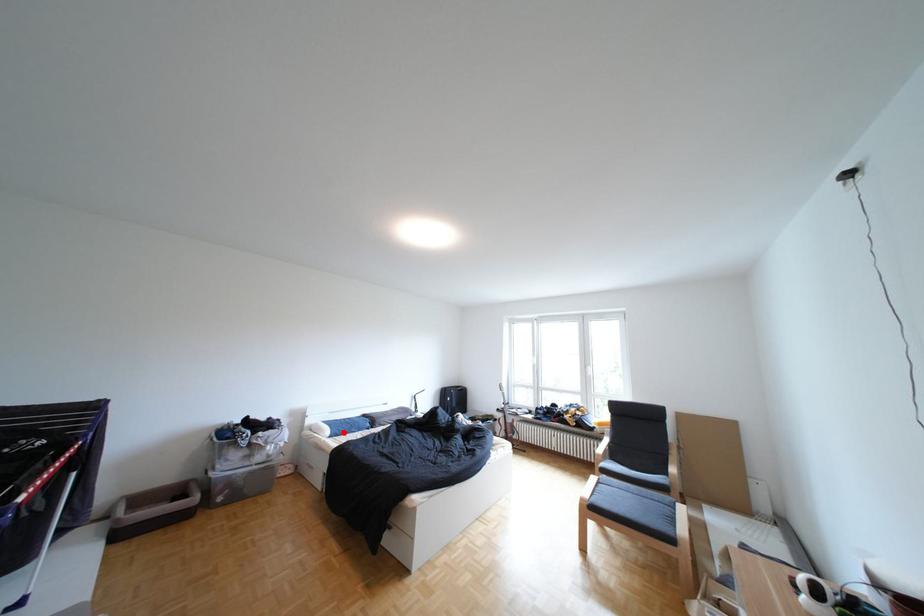
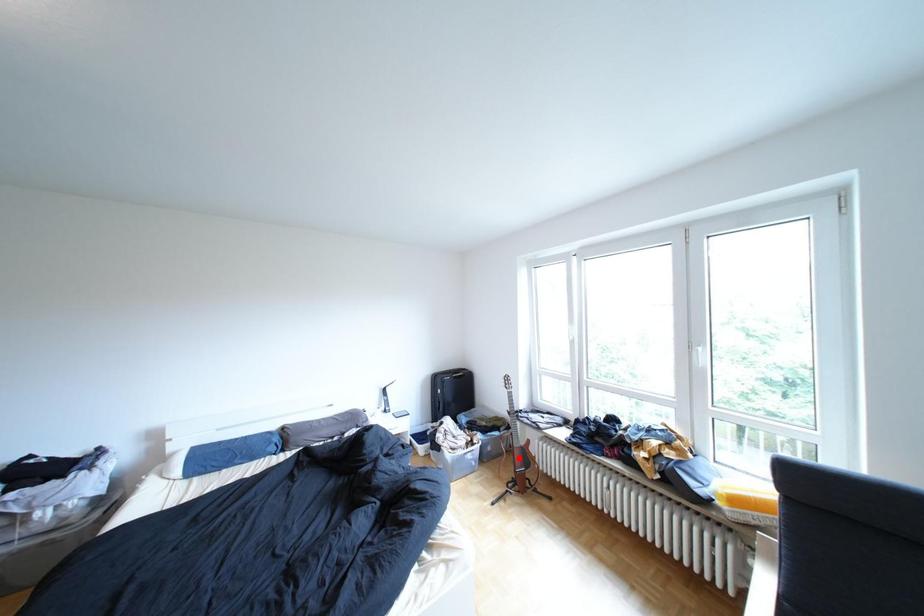
I am providing you with two images of the same scene from different viewpoints. A red point is marked on the first image and another point is marked on the second image. Does the point marked in image1 correspond to the same location as the one in image2?

No